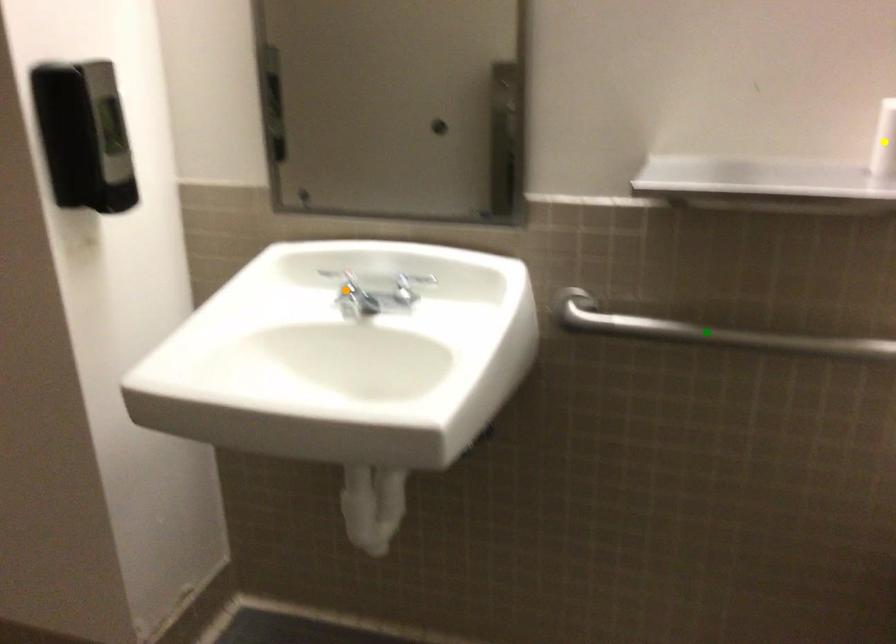
Order these from nearest to farthest:
orange point, green point, yellow point

yellow point
green point
orange point